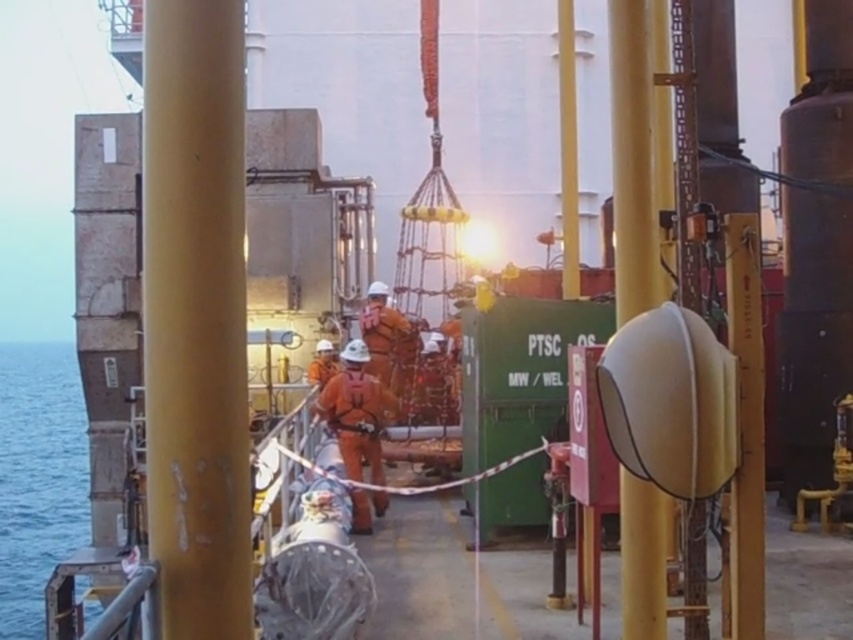
The width and height of the screenshot is (853, 640). What do you see at coordinates (195, 316) in the screenshot?
I see `smooth yellow pole at center` at bounding box center [195, 316].

Who is more distant from viewer, (143, 209) or (358, 397)?

Positioned behind is point (358, 397).

This screenshot has width=853, height=640. In order to click on smooth yellow pole at center in this screenshot , I will do pyautogui.click(x=195, y=316).

Does yellow matte/rough pipe at center-right have a greater height compared to orange fabric safety suit at center?

No.

Is yellow matte/rough pipe at center-right smaller than orange fabric safety suit at center?

Indeed, yellow matte/rough pipe at center-right has a smaller size compared to orange fabric safety suit at center.

Is point (641, 52) in front of point (364, 449)?

Yes, it is.

I want to click on yellow matte/rough pipe at center-right, so click(634, 157).

Who is positioned more to the left, smooth yellow pole at center or blue water at left?

blue water at left is more to the left.

Does smooth yellow pole at center have a larger size compared to blue water at left?

Incorrect, smooth yellow pole at center is not larger than blue water at left.

Is point (241, 541) less distant than point (55, 529)?

Yes, it is in front of point (55, 529).

This screenshot has height=640, width=853. I want to click on smooth yellow pole at center, so click(x=195, y=316).